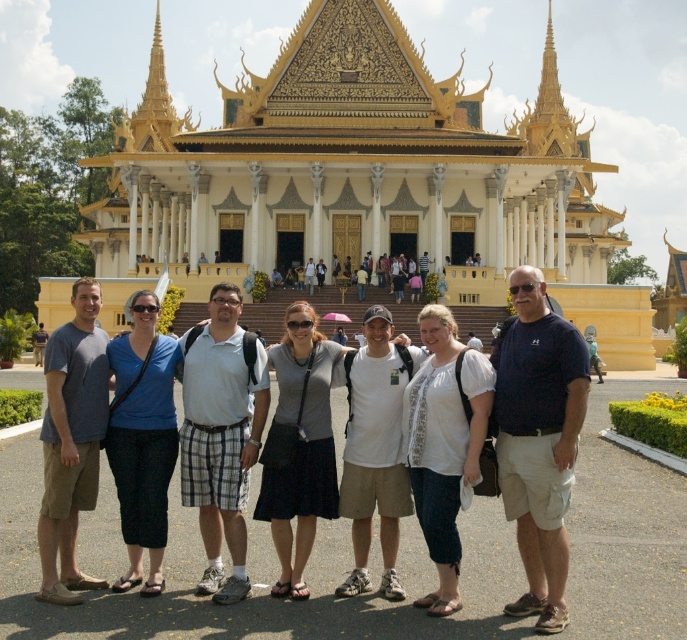
Question: Which of these objects is positioned farthest from the white cotton t-shirt at center?

Choices:
 (A) white cotton shirt at center
 (B) matte gray shirt at center

Answer: (B)

Question: Is gold/golden/temple at center smaller than white cotton t-shirt at center?

Choices:
 (A) no
 (B) yes

Answer: (A)

Question: Is white cotton shirt at center behind matte gray shirt at center?

Choices:
 (A) yes
 (B) no

Answer: (B)

Question: Considering the relative positions of white cotton shirt at center and white cotton t-shirt at center in the image provided, where is white cotton shirt at center located with respect to white cotton t-shirt at center?

Choices:
 (A) above
 (B) below

Answer: (B)

Question: Which object is the farthest from the white cotton shirt at center?

Choices:
 (A) gold/golden/temple at center
 (B) matte gray shirt at center
 (C) white cotton t-shirt at center

Answer: (A)

Question: Among these points, which one is nearest to the camera?

Choices:
 (A) (271, 348)
 (B) (225, 173)

Answer: (A)